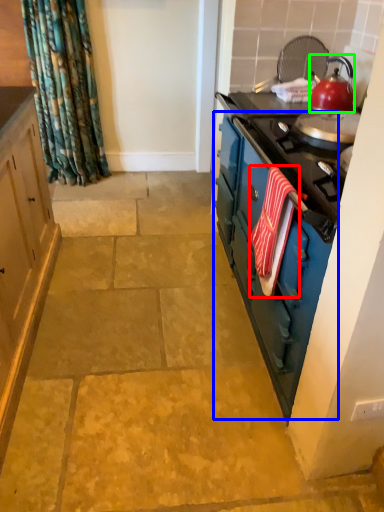
Question: Which object is the farthest from beach towel (highlighted by a red box)? Choose among these: dresser (highlighted by a blue box) or kitchen appliance (highlighted by a green box).

Choices:
 (A) dresser
 (B) kitchen appliance

Answer: (B)